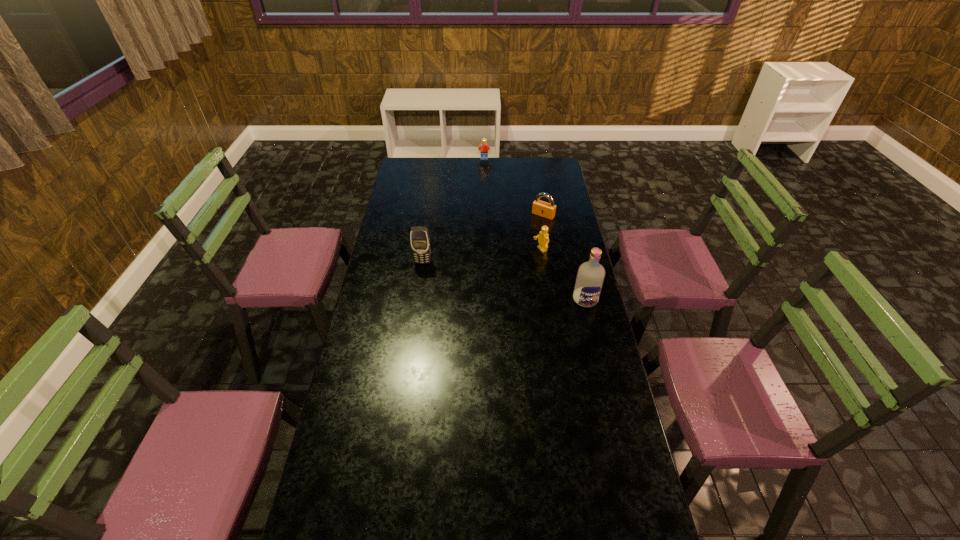
Find the location of a particular element. This screenshot has height=540, width=960. object present at the far edge is located at coordinates (483, 148).

Locate an element on the screen. object that is positioned at the left edge is located at coordinates (419, 236).

Locate an element on the screen. vodka positioned at the right edge is located at coordinates (591, 274).

Identify the location of padlock located at the right edge. The height and width of the screenshot is (540, 960). (547, 210).

This screenshot has height=540, width=960. I want to click on Lego that is at the right edge, so click(543, 237).

The image size is (960, 540). I want to click on free space at the far edge of the desktop, so click(528, 162).

The image size is (960, 540). In order to click on vacant space at the near edge of the desktop in this screenshot , I will do `click(381, 518)`.

The width and height of the screenshot is (960, 540). In the image, there is a desktop. Find the location of `vacant region at the left edge`. vacant region at the left edge is located at coordinates (359, 382).

Where is `blank space at the right edge`? blank space at the right edge is located at coordinates (611, 436).

Where is `vacant region at the near left corner of the desktop`? This screenshot has height=540, width=960. vacant region at the near left corner of the desktop is located at coordinates [x=372, y=511].